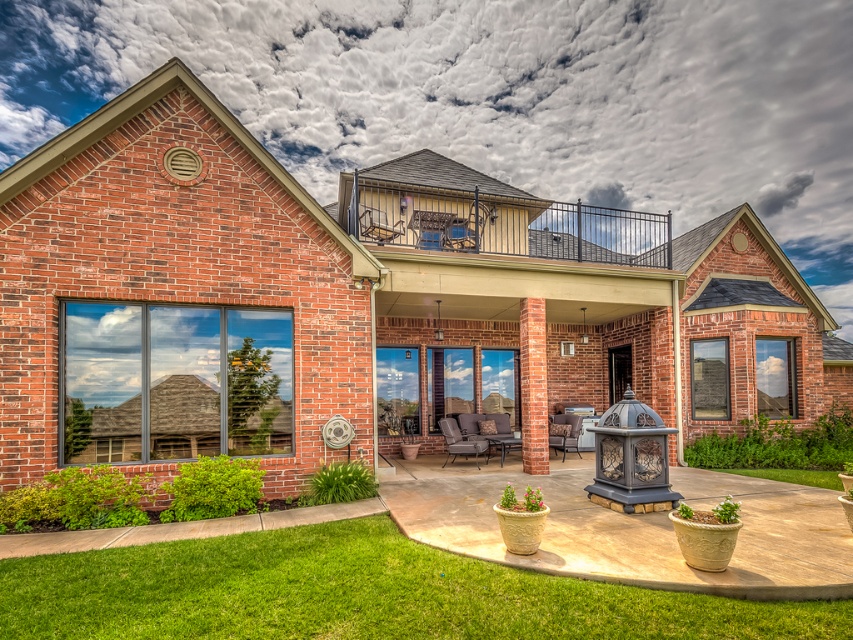
You are standing on the patio and want to walk towards the house. Which object, the green grass at lower left or the metallic lantern at center, will you pass first?

The green grass at lower left is closer to the viewer than the metallic lantern at center, so you will pass the green grass at lower left first when walking towards the house.

You are a gardener who wants to mow the green grass at lower left. Considering the height of the metallic lantern at center, will the grass be tall enough to mow?

The green grass at lower left is shorter than the metallic lantern at center, but grass height for mowing is typically measured relative to itself rather than objects. However, since it is described as shorter than the lantern, it might still be mowable if it has grown sufficiently. Check its actual height before mowing.

You are standing at the point labeled point (x=650, y=612) and want to walk to the front door of the house. The front door is located 4.32 meters away from your current position. Is the front door closer to the house or the decorative lantern? Please explain your reasoning based on the scene description.

The front door is 4.32 meters away from the point labeled point (x=650, y=612). Since the front door is located at the house, which is the main structure, and the decorative lantern is part of the patio area, the front door is closer to the house than the lantern.